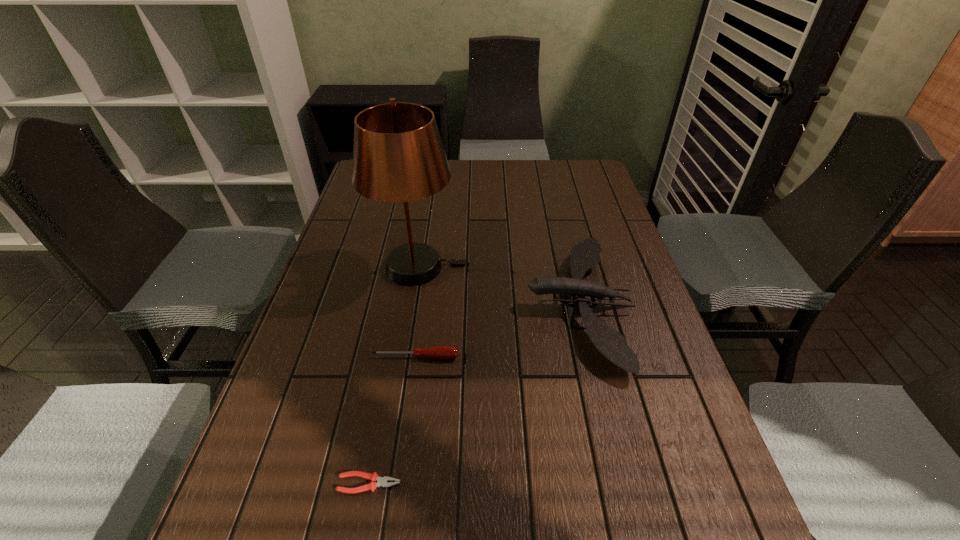
Identify the location of vacant point that satisfies the following two spatial constraints: 1. on the front-facing side of the tallest object; 2. on the right side of the second shortest object. This screenshot has height=540, width=960. (404, 357).

This screenshot has height=540, width=960. In order to click on free space that satisfies the following two spatial constraints: 1. on the front-facing side of the lampshade; 2. on the front side of the pliers in this screenshot , I will do `click(384, 483)`.

Locate an element on the screen. vacant space that satisfies the following two spatial constraints: 1. on the front-facing side of the tallest object; 2. on the right side of the second shortest object is located at coordinates (404, 357).

Where is `free spot that satisfies the following two spatial constraints: 1. at the head of the drone; 2. on the front side of the nearest object`? The image size is (960, 540). free spot that satisfies the following two spatial constraints: 1. at the head of the drone; 2. on the front side of the nearest object is located at coordinates click(x=620, y=483).

This screenshot has height=540, width=960. I want to click on vacant area that satisfies the following two spatial constraints: 1. on the front-facing side of the lampshade; 2. on the back side of the screwdriver, so [404, 357].